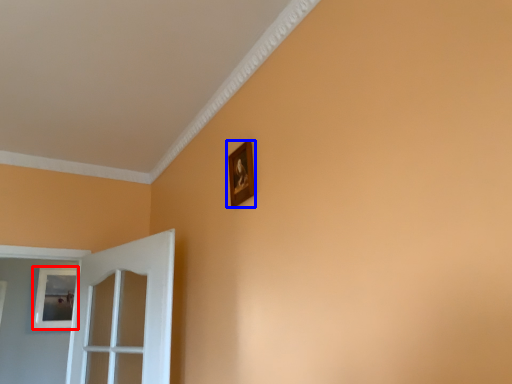
Question: Which point is closer to the camera, picture frame (highlighted by a red box) or picture frame (highlighted by a blue box)?

Choices:
 (A) picture frame
 (B) picture frame

Answer: (B)